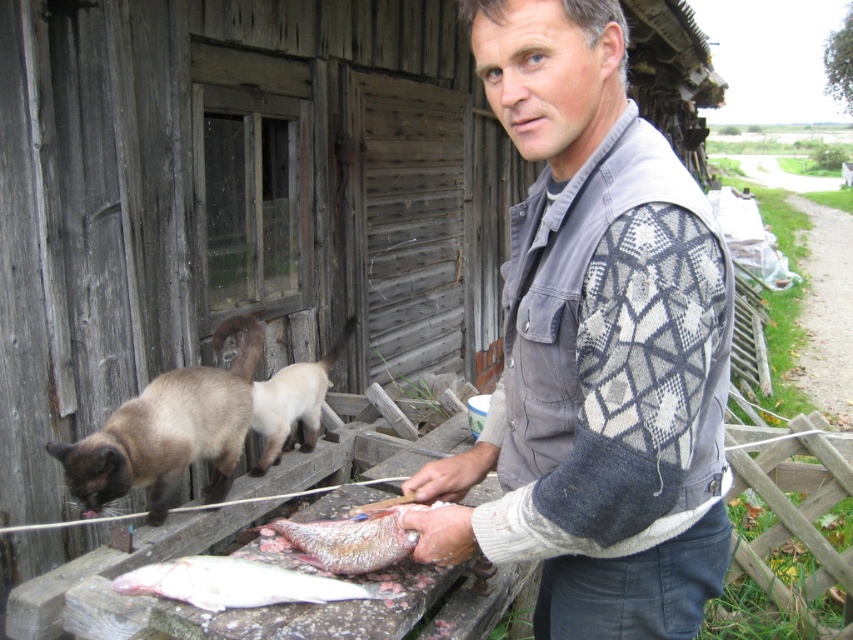
You are a cat watching the man clean the fish. From your position next to the siamese fur cat at left, can you see the white fleshed fish at lower center?

The white fleshed fish at lower center is behind the siamese fur cat at left, so you cannot see it from your current position next to the siamese fur cat at left.

Where is the siamese fur cat at left located in the image?

The siamese fur cat at left is located at point (169, 432) in the image.